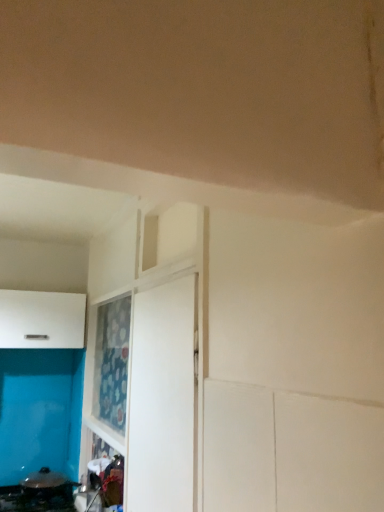
Question: Does white matte cabinet at left have a larger size compared to white matte door at center?

Choices:
 (A) no
 (B) yes

Answer: (B)

Question: Is white matte cabinet at left closer to the viewer compared to white matte door at center?

Choices:
 (A) yes
 (B) no

Answer: (B)

Question: Is white matte cabinet at left smaller than white matte door at center?

Choices:
 (A) no
 (B) yes

Answer: (A)

Question: From the image's perspective, is white matte cabinet at left located above white matte door at center?

Choices:
 (A) yes
 (B) no

Answer: (A)

Question: From a real-world perspective, is white matte cabinet at left physically below white matte door at center?

Choices:
 (A) yes
 (B) no

Answer: (B)

Question: Considering the positions of black glossy pan at lower left and white matte cabinet at left in the image, is black glossy pan at lower left taller or shorter than white matte cabinet at left?

Choices:
 (A) tall
 (B) short

Answer: (B)

Question: Would you say black glossy pan at lower left is to the left or to the right of white matte cabinet at left in the picture?

Choices:
 (A) right
 (B) left

Answer: (A)

Question: From a real-world perspective, is black glossy pan at lower left positioned above or below white matte cabinet at left?

Choices:
 (A) below
 (B) above

Answer: (A)

Question: From the image's perspective, relative to white matte cabinet at left, is black glossy pan at lower left above or below?

Choices:
 (A) below
 (B) above

Answer: (A)

Question: Looking at their shapes, would you say white matte door at center is wider or thinner than white matte cabinet at left?

Choices:
 (A) thin
 (B) wide

Answer: (A)

Question: From the image's perspective, is white matte door at center above or below white matte cabinet at left?

Choices:
 (A) below
 (B) above

Answer: (A)

Question: Which is correct: white matte door at center is inside white matte cabinet at left, or outside of it?

Choices:
 (A) inside
 (B) outside

Answer: (B)

Question: From a real-world perspective, relative to white matte cabinet at left, is white matte door at center vertically above or below?

Choices:
 (A) below
 (B) above

Answer: (A)

Question: Looking at their shapes, would you say white matte door at center is wider or thinner than black glossy pan at lower left?

Choices:
 (A) wide
 (B) thin

Answer: (B)

Question: Considering the positions of white matte door at center and black glossy pan at lower left in the image, is white matte door at center bigger or smaller than black glossy pan at lower left?

Choices:
 (A) big
 (B) small

Answer: (B)